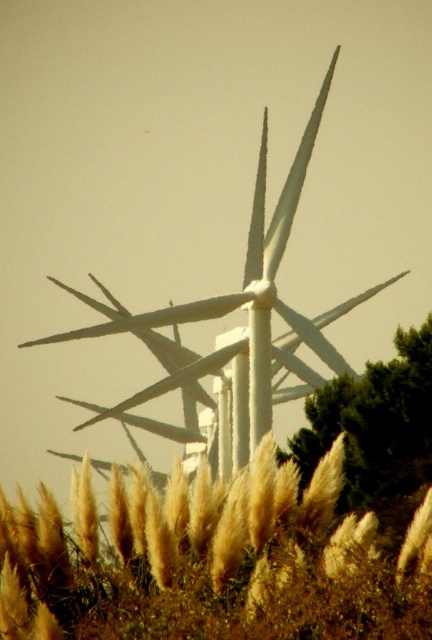
Which is more to the right, golden textured grass at lower center or white matte windmill at center?

Positioned to the right is golden textured grass at lower center.

The width and height of the screenshot is (432, 640). In order to click on golden textured grass at lower center in this screenshot , I will do `click(210, 561)`.

Image resolution: width=432 pixels, height=640 pixels. I want to click on golden textured grass at lower center, so click(210, 561).